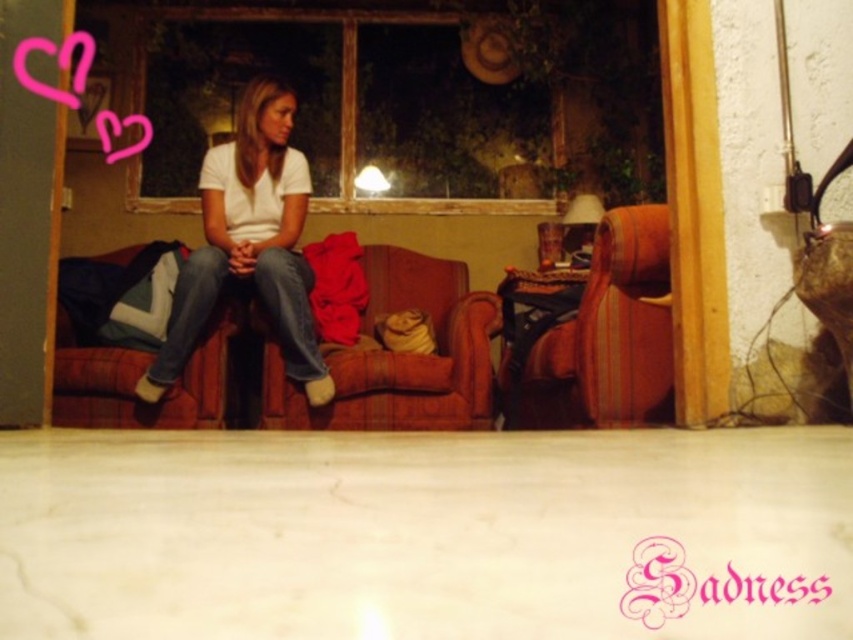
Question: Which of these objects is positioned closest to the brown leather armchair at right?

Choices:
 (A) velvet-like brown couch at center
 (B) white matte shirt at center

Answer: (A)

Question: Among these points, which one is nearest to the camera?

Choices:
 (A) (274, 362)
 (B) (294, 236)

Answer: (A)

Question: Can you confirm if velvet-like brown couch at center is smaller than brown leather armchair at right?

Choices:
 (A) no
 (B) yes

Answer: (A)

Question: Which object appears farthest from the camera in this image?

Choices:
 (A) brown leather armchair at right
 (B) white matte shirt at center

Answer: (B)

Question: Is velvet-like brown couch at center below white matte shirt at center?

Choices:
 (A) yes
 (B) no

Answer: (A)

Question: Can you confirm if velvet-like brown couch at center is positioned below white matte shirt at center?

Choices:
 (A) no
 (B) yes

Answer: (B)